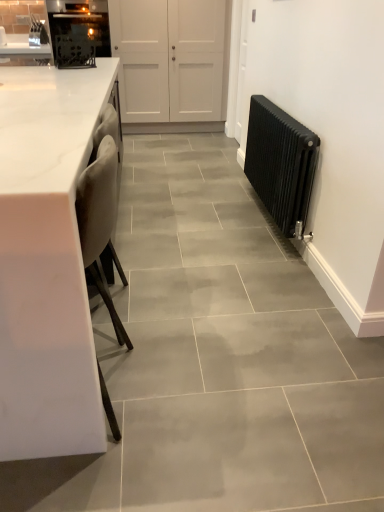
Question: From the image's perspective, would you say black matte oven at upper left is positioned over white matte door at upper center?

Choices:
 (A) no
 (B) yes

Answer: (B)

Question: Is black matte oven at upper left completely or partially outside of white matte door at upper center?

Choices:
 (A) no
 (B) yes

Answer: (A)

Question: Is black matte oven at upper left thinner than white matte door at upper center?

Choices:
 (A) no
 (B) yes

Answer: (B)

Question: Is black matte oven at upper left touching white matte door at upper center?

Choices:
 (A) yes
 (B) no

Answer: (B)

Question: From the image's perspective, is black matte oven at upper left below white matte door at upper center?

Choices:
 (A) yes
 (B) no

Answer: (B)

Question: From a real-world perspective, is black matte oven at upper left positioned over white matte door at upper center based on gravity?

Choices:
 (A) yes
 (B) no

Answer: (A)

Question: Does black matte oven at upper left come in front of black metal radiator at right?

Choices:
 (A) no
 (B) yes

Answer: (A)

Question: Is black metal radiator at right a part of black matte oven at upper left?

Choices:
 (A) no
 (B) yes

Answer: (A)

Question: Is black matte oven at upper left at the right side of black metal radiator at right?

Choices:
 (A) yes
 (B) no

Answer: (B)

Question: From a real-world perspective, does black matte oven at upper left stand above black metal radiator at right?

Choices:
 (A) yes
 (B) no

Answer: (A)

Question: From the image's perspective, would you say black matte oven at upper left is shown under black metal radiator at right?

Choices:
 (A) no
 (B) yes

Answer: (A)

Question: Considering the relative sizes of black matte oven at upper left and black metal radiator at right in the image provided, is black matte oven at upper left taller than black metal radiator at right?

Choices:
 (A) yes
 (B) no

Answer: (A)

Question: Considering the relative positions of black matte oven at upper left and white marble countertop at left in the image provided, is black matte oven at upper left in front of white marble countertop at left?

Choices:
 (A) yes
 (B) no

Answer: (B)